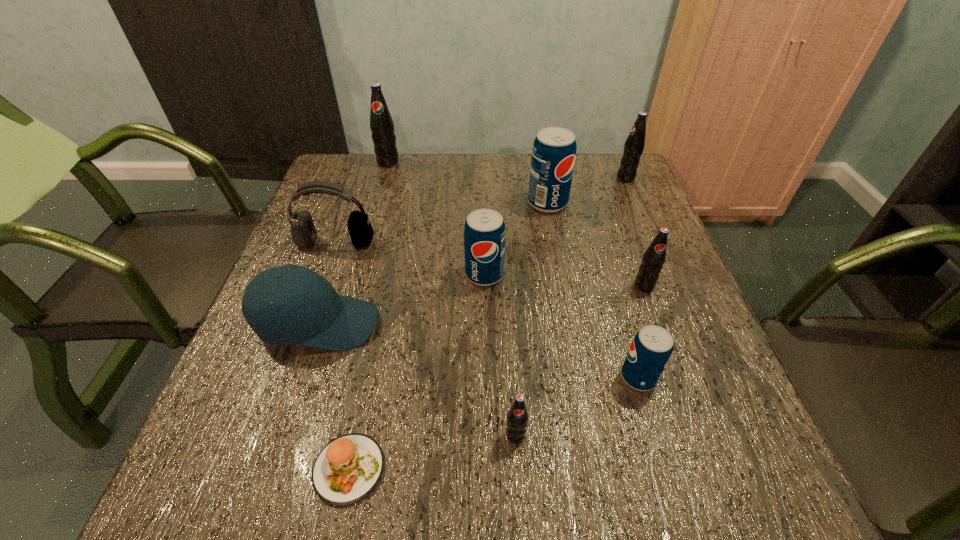
Identify the location of the farthest pop. The height and width of the screenshot is (540, 960). click(x=381, y=123).

In order to click on the tallest object in this screenshot , I will do `click(381, 123)`.

What are the coordinates of `the biggest blue pop` in the screenshot? It's located at (553, 157).

This screenshot has height=540, width=960. I want to click on the eighth nearest object, so click(553, 157).

The height and width of the screenshot is (540, 960). I want to click on the third nearest black pop, so click(634, 145).

The width and height of the screenshot is (960, 540). Find the location of `the rightmost object`. the rightmost object is located at coordinates (634, 145).

What are the coordinates of `black headset` in the screenshot? It's located at (303, 231).

Find the location of `headset`. headset is located at coordinates (303, 231).

The width and height of the screenshot is (960, 540). I want to click on the second smallest blue pop, so click(484, 233).

This screenshot has height=540, width=960. I want to click on the second nearest blue pop, so click(x=484, y=233).